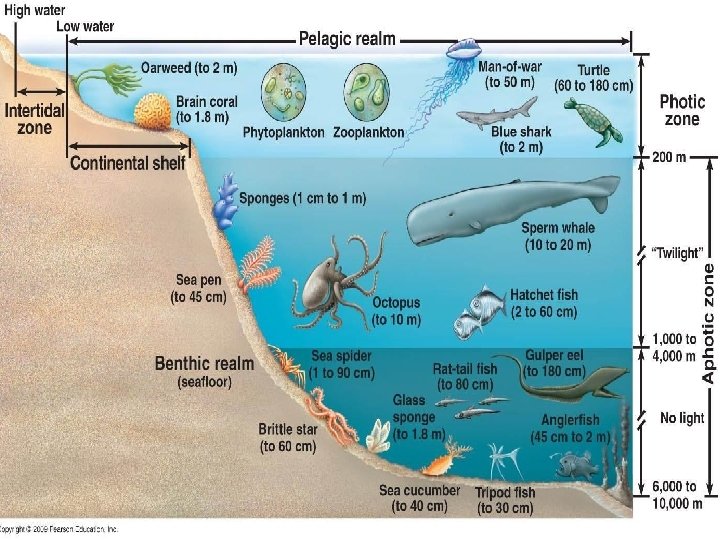
Locate an element on the screen. sponge is located at coordinates (225, 200).